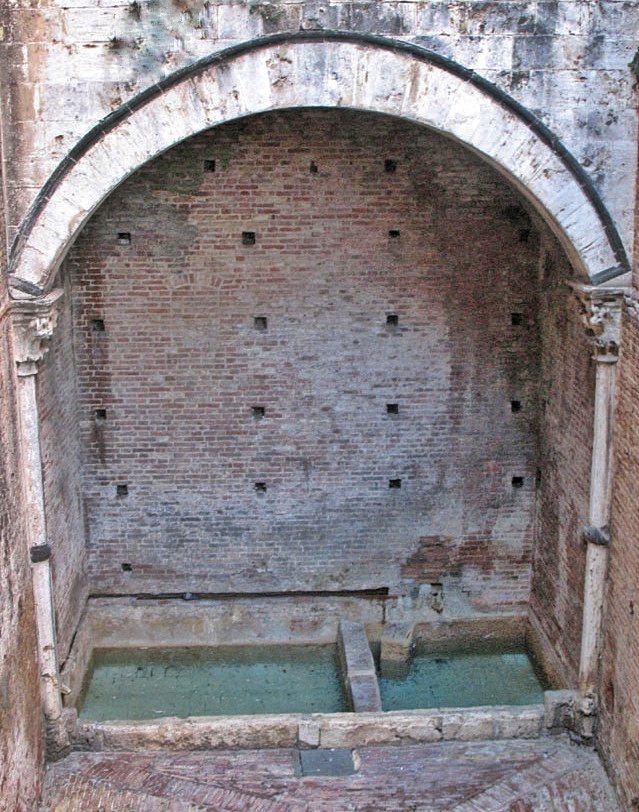
Find the location of `wall`. wall is located at coordinates (73, 58), (316, 342), (570, 398), (50, 416).